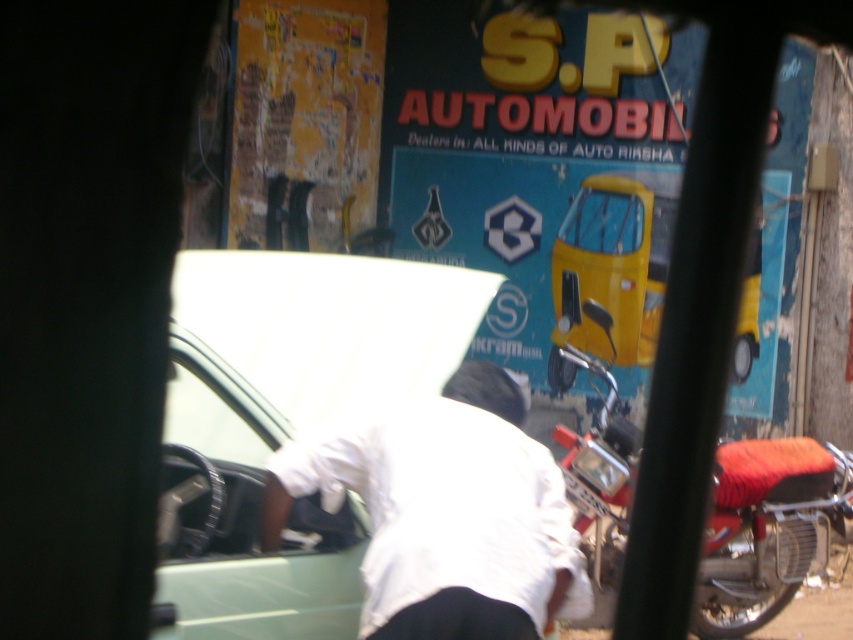
Question: Among these points, which one is farthest from the camera?

Choices:
 (A) (750, 545)
 (B) (398, 529)

Answer: (A)

Question: Does white cloth at center appear on the right side of red leather motorcycle at right?

Choices:
 (A) no
 (B) yes

Answer: (A)

Question: Which of the following is the closest to the observer?

Choices:
 (A) red leather motorcycle at right
 (B) white cloth at center

Answer: (B)

Question: Which of the following is the farthest from the observer?

Choices:
 (A) (751, 532)
 (B) (372, 548)

Answer: (A)

Question: Does white cloth at center appear on the right side of red leather motorcycle at right?

Choices:
 (A) no
 (B) yes

Answer: (A)

Question: Does white cloth at center have a greater width compared to red leather motorcycle at right?

Choices:
 (A) yes
 (B) no

Answer: (B)